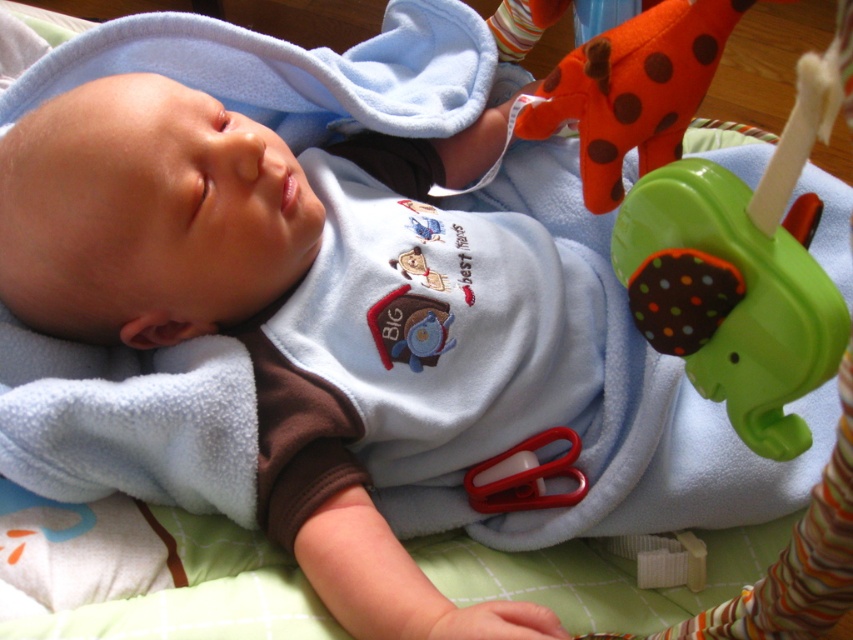
Question: Observing the image, what is the correct spatial positioning of green plastic elephant at upper right in reference to matte plastic teething ring at center?

Choices:
 (A) left
 (B) right

Answer: (B)

Question: Is orange felt giraffe at upper right below matte plastic teething ring at center?

Choices:
 (A) no
 (B) yes

Answer: (A)

Question: Is green plastic elephant at upper right thinner than matte plastic teething ring at center?

Choices:
 (A) no
 (B) yes

Answer: (A)

Question: Which object appears closest to the camera in this image?

Choices:
 (A) orange felt giraffe at upper right
 (B) green plastic elephant at upper right

Answer: (B)

Question: Which object is the farthest from the orange felt giraffe at upper right?

Choices:
 (A) matte plastic teething ring at center
 (B) green plastic elephant at upper right

Answer: (A)

Question: Which of the following is the closest to the observer?

Choices:
 (A) (288, 209)
 (B) (781, 285)
 (C) (677, 52)

Answer: (B)